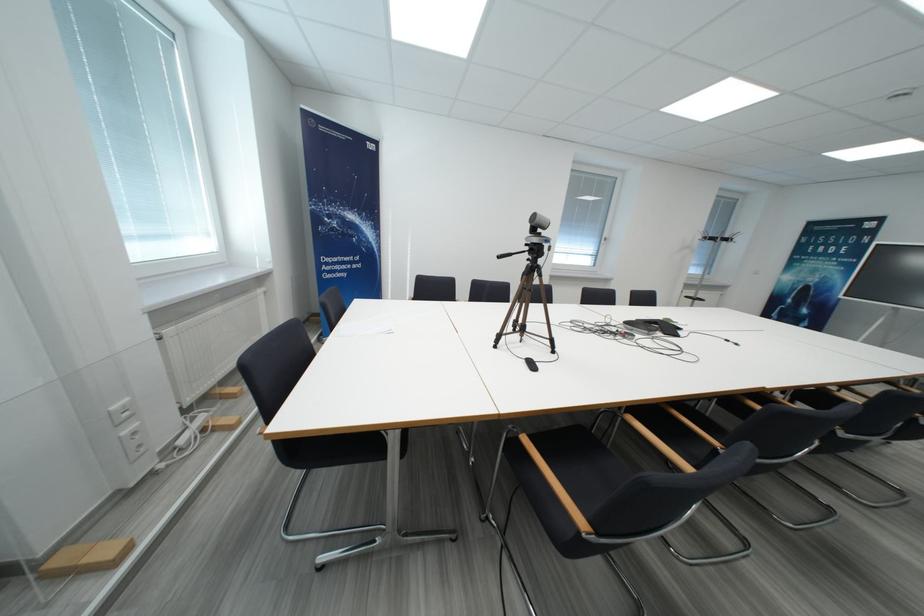
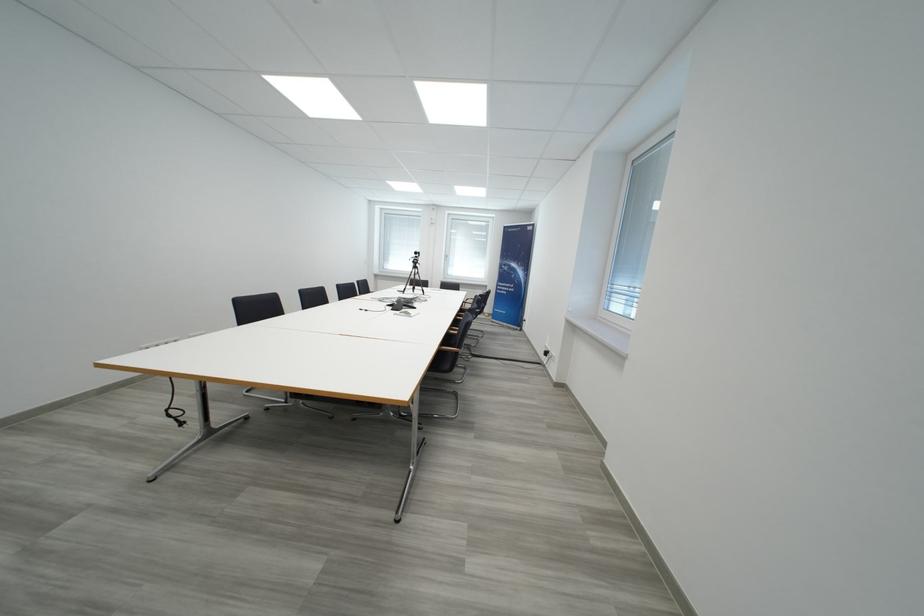
In the second image, find the point that corresponds to [685,339] in the first image.

(395, 309)